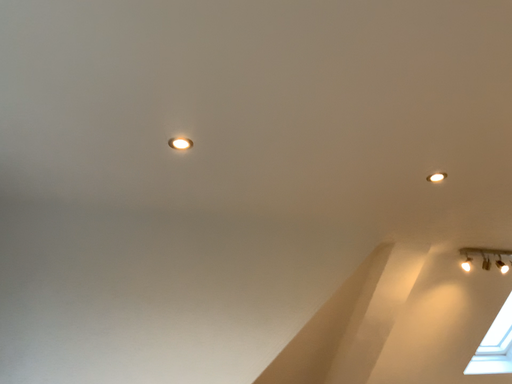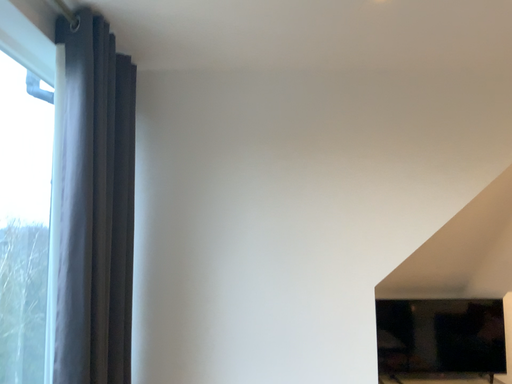
Question: How did the camera likely rotate when shooting the video?

Choices:
 (A) rotated right
 (B) rotated left

Answer: (B)